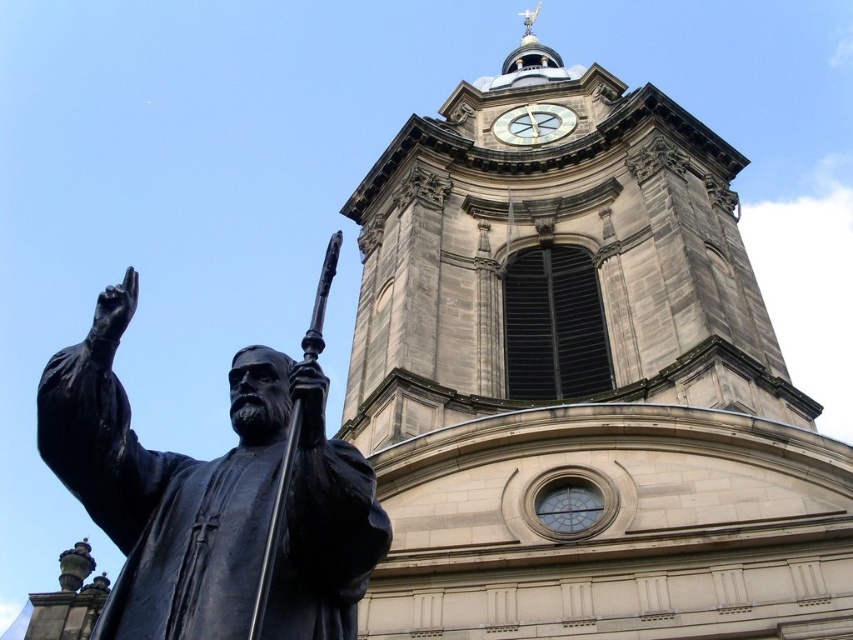
Question: Which point is closer to the camera?

Choices:
 (A) white stone clock at upper center
 (B) black polished statue at left

Answer: (B)

Question: Which of the following is the closest to the observer?

Choices:
 (A) (544, 104)
 (B) (181, 579)

Answer: (B)

Question: Can you confirm if black polished statue at left is positioned to the right of white stone clock at upper center?

Choices:
 (A) no
 (B) yes

Answer: (A)

Question: Does black polished statue at left come behind white stone clock at upper center?

Choices:
 (A) yes
 (B) no

Answer: (B)

Question: From the image, what is the correct spatial relationship of black polished statue at left in relation to white stone clock at upper center?

Choices:
 (A) above
 (B) below

Answer: (B)